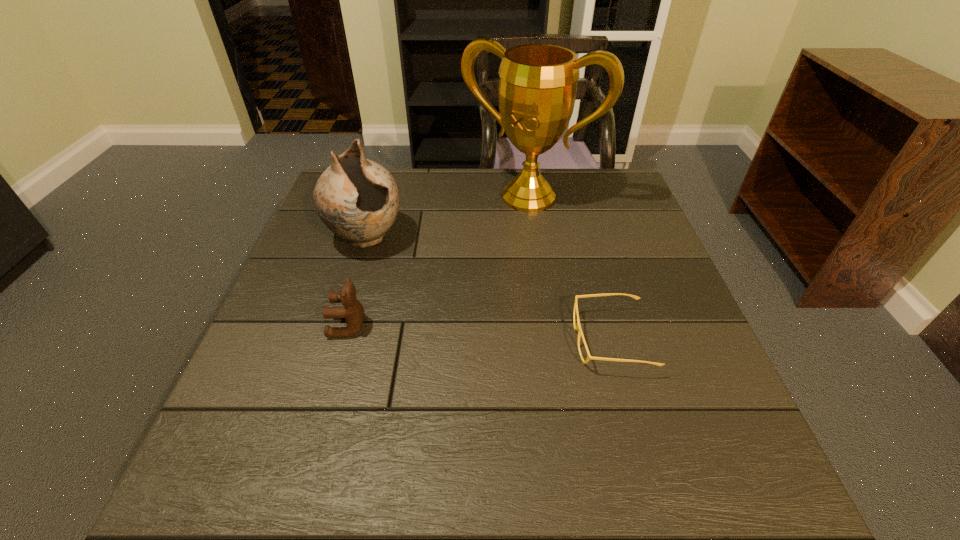
The image size is (960, 540). In order to click on free space on the desktop that is between the second shortest object and the shortest object and is positioned on the front-facing side of the tallest object in this screenshot , I will do `click(449, 331)`.

I want to click on free space on the desktop that is between the teddy bear and the spectacles and is positioned from the spout of the second tallest object, so click(455, 332).